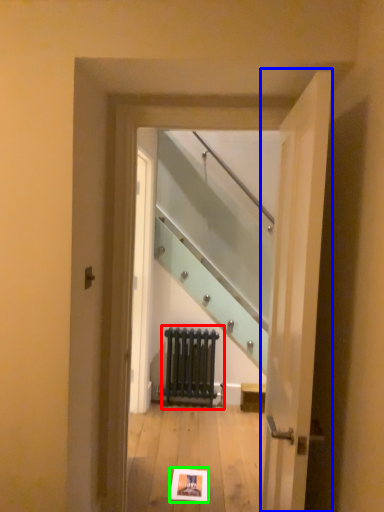
Question: Which is nearer to the radiator (highlighted by a red box)? door (highlighted by a blue box) or postcard (highlighted by a green box).

Choices:
 (A) door
 (B) postcard

Answer: (B)